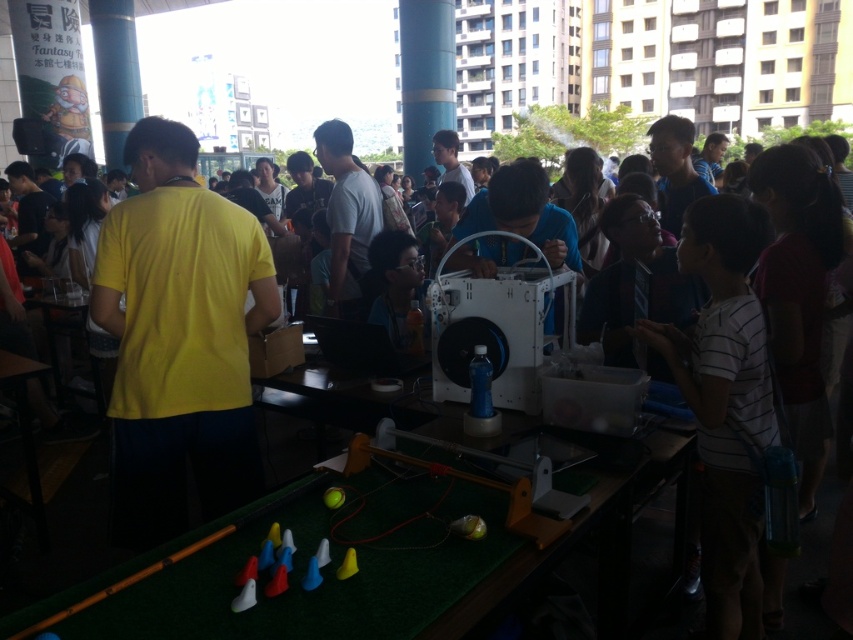
Question: Which point is farther from the camera taking this photo?

Choices:
 (A) tap(137, 204)
 (B) tap(756, 252)

Answer: (A)

Question: Does yellow matte shirt at center have a larger size compared to white striped shirt at center?

Choices:
 (A) yes
 (B) no

Answer: (A)

Question: Does yellow matte shirt at center appear on the left side of white striped shirt at center?

Choices:
 (A) no
 (B) yes

Answer: (B)

Question: Is yellow matte shirt at center to the left of white striped shirt at center from the viewer's perspective?

Choices:
 (A) yes
 (B) no

Answer: (A)